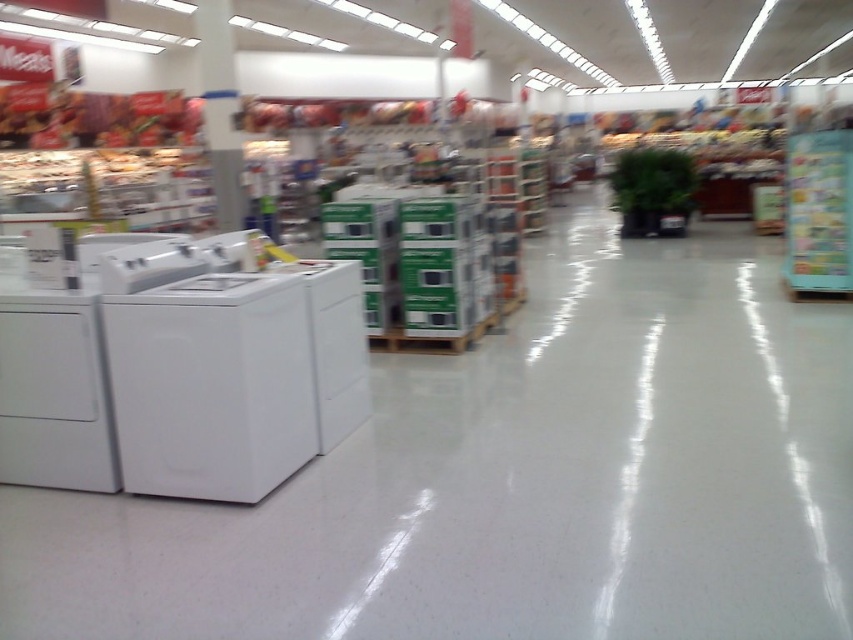
You are a delivery person who needs to load a white glossy washer into a truck. The truck has a height restriction of 1.5 meters. Given the white glossy washer at left and the white glossy washer at center, which washer should you choose to ensure it fits under the height limit?

The white glossy washer at center has a smaller height compared to the white glossy washer at left. Since the truck has a height restriction of 1.5 meters, you should choose the white glossy washer at center to ensure it fits under the height limit.

You are a customer in the store and want to reach the white glossy washer at center. You are currently standing next to the white glossy washer at left. Which direction should you move to get there?

The white glossy washer at left is to the left of the white glossy washer at center, so you should move to the right to reach the white glossy washer at center.